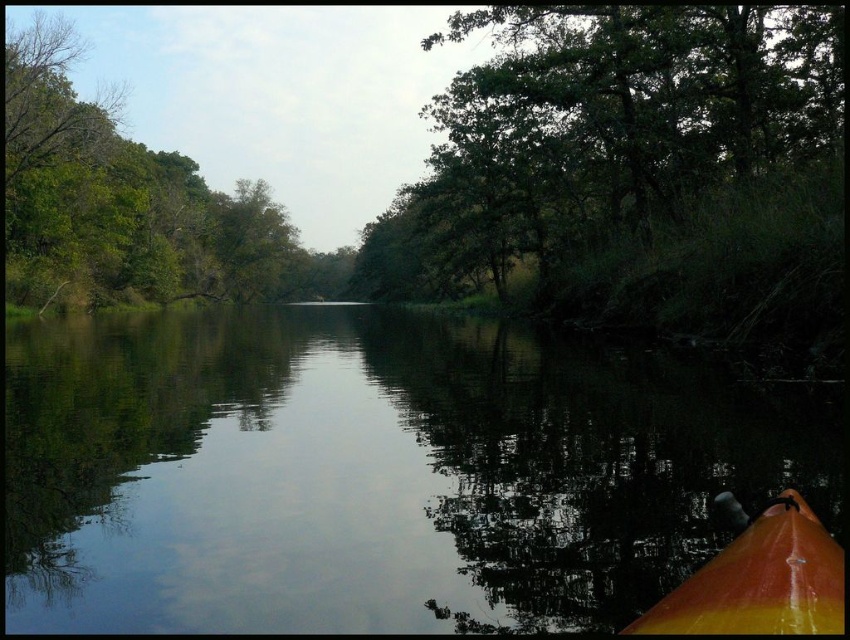
Question: Does smooth water at center appear on the right side of green leafy trees at upper left?

Choices:
 (A) yes
 (B) no

Answer: (A)

Question: Which object is the farthest from the smooth water at center?

Choices:
 (A) green leafy tree at upper center
 (B) green leafy trees at upper left
 (C) orange glossy canoe at lower right

Answer: (B)

Question: In this image, where is green leafy tree at upper center located relative to orange glossy canoe at lower right?

Choices:
 (A) left
 (B) right

Answer: (A)

Question: Is green leafy trees at upper left to the right of orange glossy canoe at lower right from the viewer's perspective?

Choices:
 (A) yes
 (B) no

Answer: (B)

Question: Estimate the real-world distances between objects in this image. Which object is farther from the smooth water at center?

Choices:
 (A) orange glossy canoe at lower right
 (B) green leafy tree at upper center

Answer: (B)

Question: Which point is farther to the camera?

Choices:
 (A) (712, 412)
 (B) (246, 211)
 (C) (649, 81)

Answer: (B)